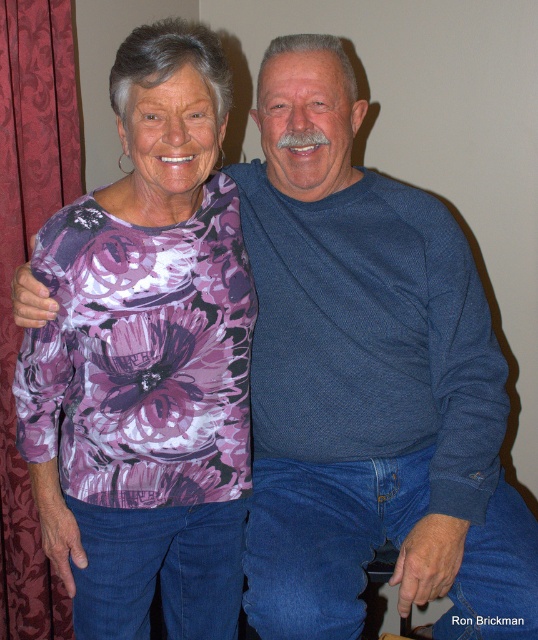
You are a photographer setting up for a portrait session. You need to ensure that the floral print shirt at center and the red velvet curtain at left are both visible in the frame. Based on their sizes, which object should you focus on to ensure both are in the shot?

The floral print shirt at center is larger than the red velvet curtain at left, so focusing on the floral print shirt at center will help ensure both are visible in the frame.

You are a photographer setting up a shoot in this room. You need to position a light source so that it illuminates the floral print shirt at center without casting a shadow on the red velvet curtain at left. Is this possible based on their positions?

The floral print shirt at center is below the red velvet curtain at left. Since the shirt is positioned lower, placing the light source above the curtain would allow light to hit the shirt while avoiding the curtain casting a shadow on it.

You are a photographer setting up for a family photo shoot. You need to position the subjects so that the floral print shirt at center is visible without being blocked by the red velvet curtain at left. Based on their current positions, is this achievable?

The floral print shirt at center is to the right of the red velvet curtain at left, so yes, it is positioned in a way that it won that is not blocked by the curtain. Therefore, the current arrangement allows the floral print shirt at center to be visible without obstruction from the red velvet curtain at left.